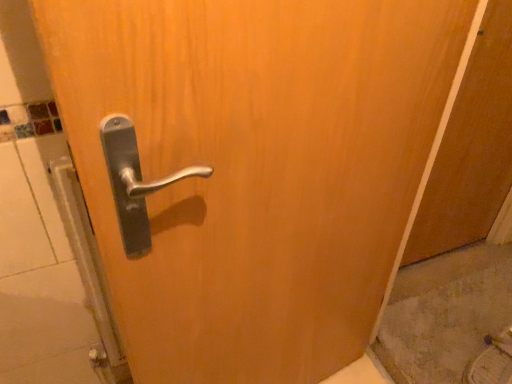
The width and height of the screenshot is (512, 384). In order to click on wooden screen door at right in this screenshot , I will do `click(471, 148)`.

The width and height of the screenshot is (512, 384). What do you see at coordinates (471, 148) in the screenshot?
I see `wooden screen door at right` at bounding box center [471, 148].

I want to click on wooden screen door at right, so click(471, 148).